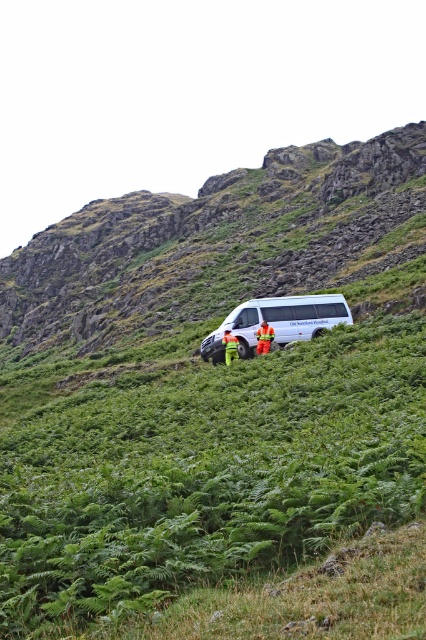
Can you confirm if green leafy grass at center is taller than reflective orange vest at center?

Correct, green leafy grass at center is much taller as reflective orange vest at center.

Is green leafy grass at center thinner than reflective orange vest at center?

In fact, green leafy grass at center might be wider than reflective orange vest at center.

Is point (291, 376) less distant than point (262, 323)?

Yes, it is in front of point (262, 323).

Find the location of a particular element. The width and height of the screenshot is (426, 640). green leafy grass at center is located at coordinates (207, 474).

Where is `green leafy grass at center`? The width and height of the screenshot is (426, 640). green leafy grass at center is located at coordinates (207, 474).

Is point (19, 515) farther from camera compared to point (339, 280)?

No, it is in front of (339, 280).

Is point (20, 458) positioned in front of point (278, 268)?

That is True.

This screenshot has height=640, width=426. Find the location of `green leafy grass at center`. green leafy grass at center is located at coordinates (207, 474).

Can you confirm if white matte van at center is shorter than orange fabric pants at center?

In fact, white matte van at center may be taller than orange fabric pants at center.

Where is `white matte van at center`? This screenshot has height=640, width=426. white matte van at center is located at coordinates (276, 321).

Which is in front, point (308, 310) or point (227, 349)?

Point (227, 349)

Where is `white matte van at center`? white matte van at center is located at coordinates coord(276,321).